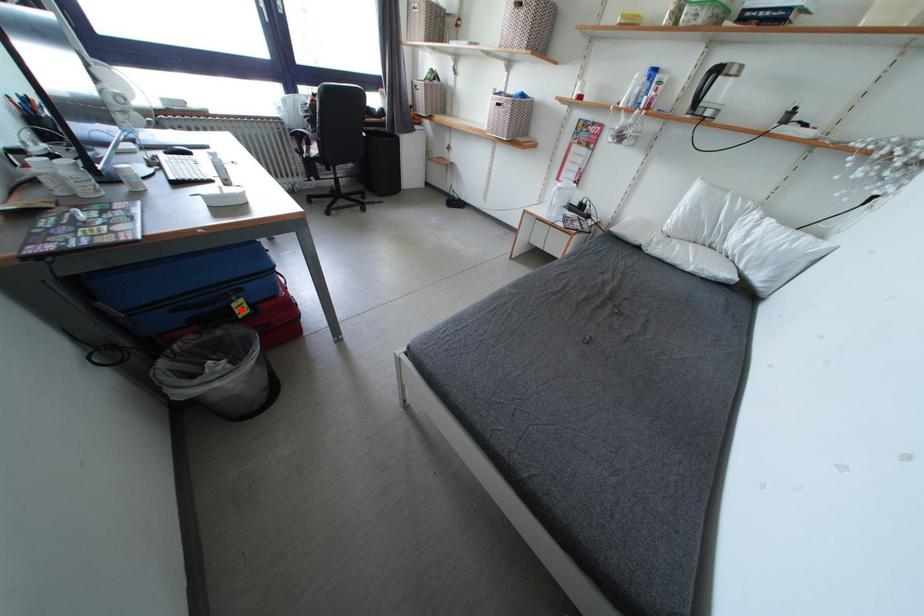
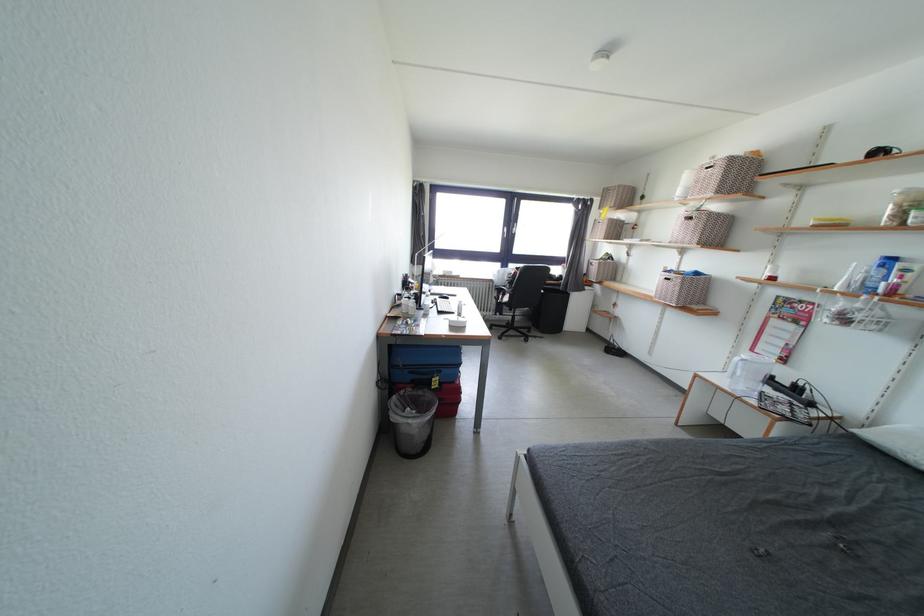
Question: I am providing you with two images of the same scene from different viewpoints. Image1 has a red point marked. In image2, the corresponding 3D location appears at what relative position? Reply with the corresponding letter.

Choices:
 (A) Closer
 (B) Farther

Answer: (B)